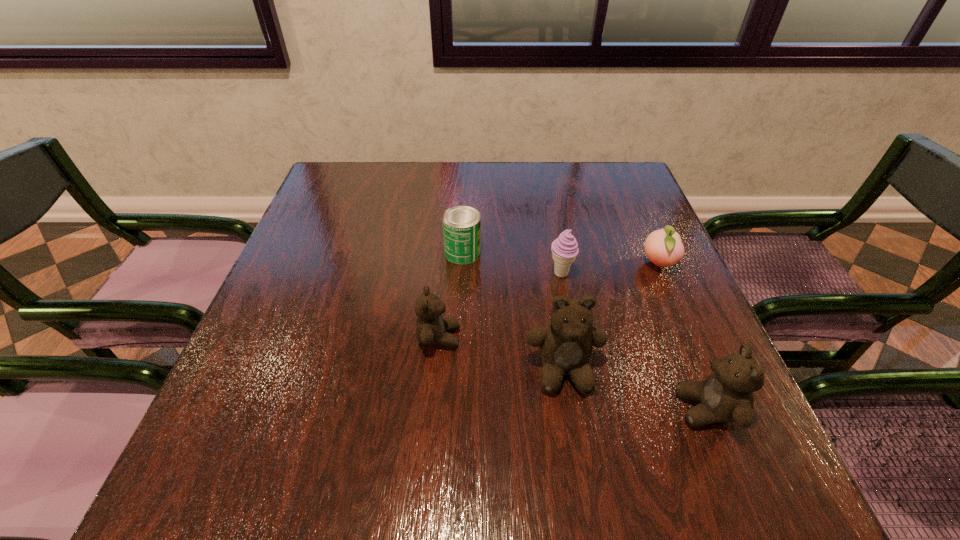
Select which teddy bear is the closest to the rightmost teddy bear. Please provide its 2D coordinates. Your answer should be formatted as a tuple, i.e. [(x, y)], where the tuple contains the x and y coordinates of a point satisfying the conditions above.

[(565, 343)]

You are a GUI agent. You are given a task and a screenshot of the screen. Output one action in this format:
    pyautogui.click(x=<x>, y=<y>)
    Task: Click on the teddy bear identified as the second closest to the peach
    Image resolution: width=960 pixels, height=540 pixels.
    Given the screenshot: What is the action you would take?
    pyautogui.click(x=726, y=395)

The height and width of the screenshot is (540, 960). I want to click on vacant region that satisfies the following two spatial constraints: 1. on the front side of the can; 2. on the right side of the icecream, so click(x=462, y=274).

I want to click on vacant region that satisfies the following two spatial constraints: 1. on the front side of the can; 2. on the face of the shortest teddy bear, so click(459, 338).

What are the coordinates of `vacant space that satisfies the following two spatial constraints: 1. on the front side of the icecream; 2. on the face of the leftmost teddy bear` in the screenshot? It's located at (573, 338).

Find the location of a particular element. Image resolution: width=960 pixels, height=540 pixels. vacant space that satisfies the following two spatial constraints: 1. on the front side of the peach; 2. on the face of the leftmost teddy bear is located at coordinates [689, 338].